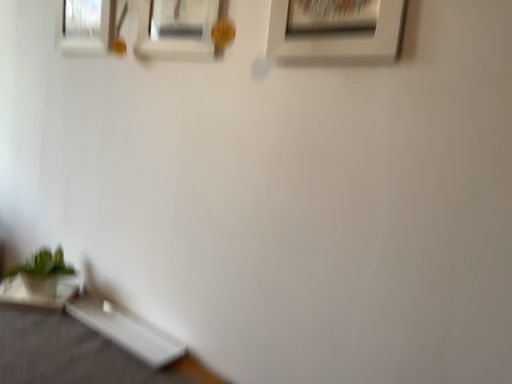
Question: Is white matte picture frame at upper center, marked as the 1th picture frame in a right-to-left arrangement, to the right of white glossy table at lower left, which ranks as the 2th table in right-to-left order, from the viewer's perspective?

Choices:
 (A) yes
 (B) no

Answer: (A)

Question: Does white matte picture frame at upper center, marked as the 1th picture frame in a right-to-left arrangement, have a lesser height compared to white glossy table at lower left, which ranks as the 2th table in right-to-left order?

Choices:
 (A) no
 (B) yes

Answer: (A)

Question: Considering the relative sizes of white matte picture frame at upper center, marked as the 1th picture frame in a right-to-left arrangement, and white glossy table at lower left, the 1th table from the left, in the image provided, is white matte picture frame at upper center, marked as the 1th picture frame in a right-to-left arrangement, bigger than white glossy table at lower left, the 1th table from the left,?

Choices:
 (A) yes
 (B) no

Answer: (A)

Question: Can you confirm if white matte picture frame at upper center, marked as the third picture frame in a left-to-right arrangement, is thinner than white glossy table at lower left, which ranks as the 2th table in right-to-left order?

Choices:
 (A) no
 (B) yes

Answer: (B)

Question: Is white matte picture frame at upper center, marked as the 1th picture frame in a right-to-left arrangement, oriented away from white glossy table at lower left, which ranks as the 2th table in right-to-left order?

Choices:
 (A) no
 (B) yes

Answer: (A)

Question: From the image's perspective, is white matte picture frame at upper center, acting as the first picture frame starting from the front, on white glossy table at lower left, the 1th table from the left?

Choices:
 (A) yes
 (B) no

Answer: (A)

Question: Is white matte picture frame at upper center, which is counted as the third picture frame, starting from the back, at the right side of green matte plant at lower left?

Choices:
 (A) yes
 (B) no

Answer: (A)

Question: Is the depth of white matte picture frame at upper center, marked as the 1th picture frame in a right-to-left arrangement, greater than that of green matte plant at lower left?

Choices:
 (A) yes
 (B) no

Answer: (B)

Question: Are white matte picture frame at upper center, marked as the 1th picture frame in a right-to-left arrangement, and green matte plant at lower left beside each other?

Choices:
 (A) no
 (B) yes

Answer: (A)

Question: From a real-world perspective, is white matte picture frame at upper center, marked as the third picture frame in a left-to-right arrangement, on top of green matte plant at lower left?

Choices:
 (A) no
 (B) yes

Answer: (B)

Question: Can you confirm if white matte picture frame at upper center, marked as the 1th picture frame in a right-to-left arrangement, is thinner than green matte plant at lower left?

Choices:
 (A) no
 (B) yes

Answer: (B)

Question: Is white matte picture frame at upper center, which is counted as the third picture frame, starting from the back, aimed at green matte plant at lower left?

Choices:
 (A) yes
 (B) no

Answer: (B)

Question: Does white glossy table at lower left, the 1th table from the left, turn towards white glossy table at lower left, which appears as the second table when viewed from the left?

Choices:
 (A) yes
 (B) no

Answer: (B)